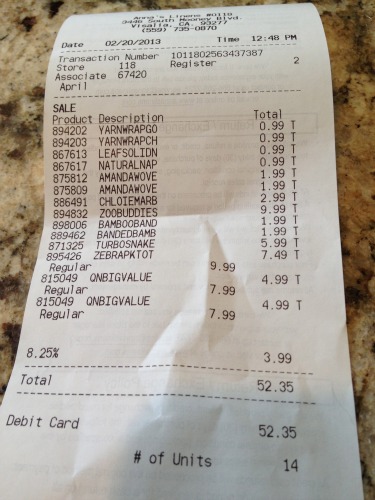
I want to click on stone tabletop, so click(x=34, y=59), click(x=362, y=184).